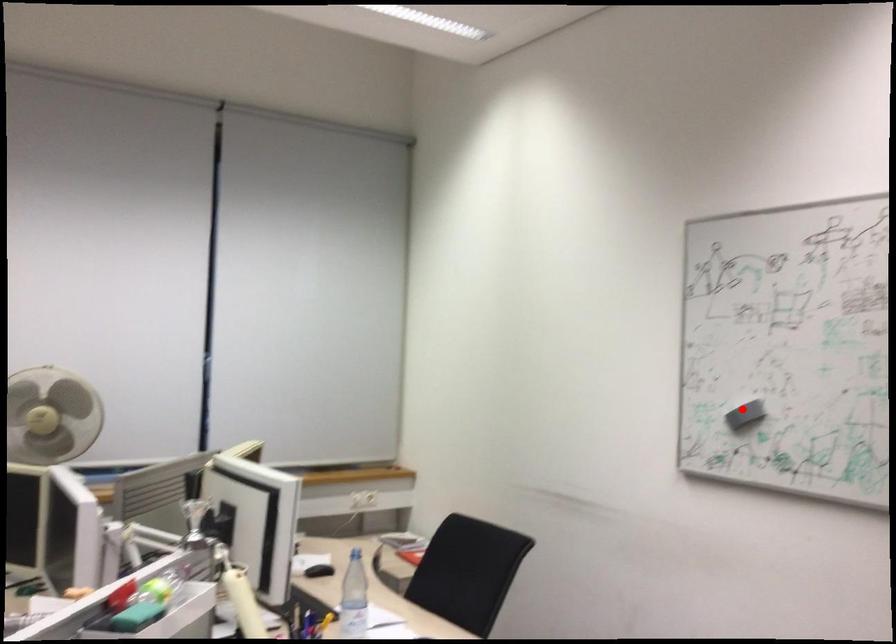
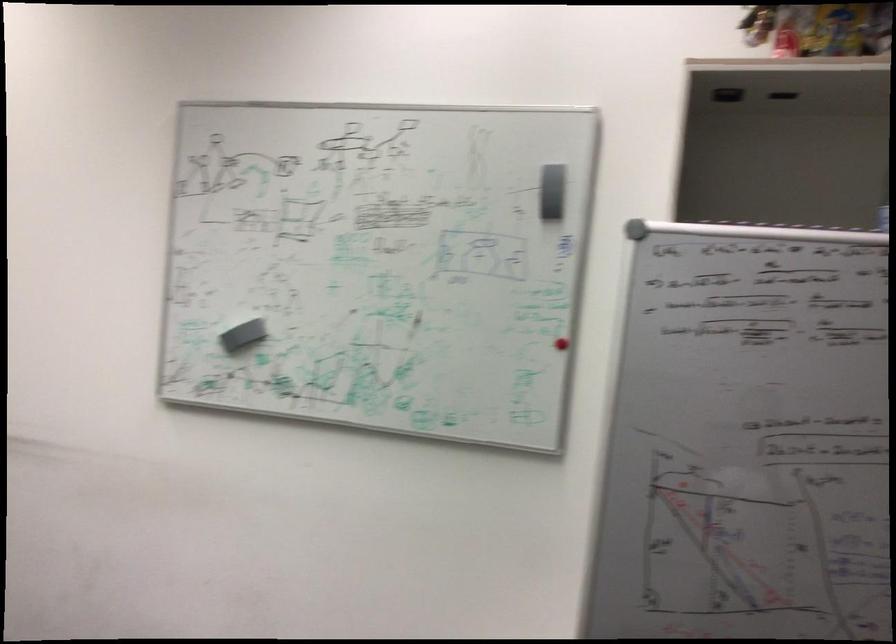
Where in the second image is the point corresponding to the highlighted location from the first image?

(239, 330)